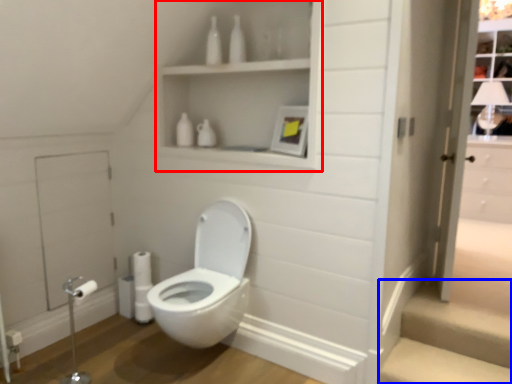
Question: Which of the following is the farthest to the observer, medicine cabinet (highlighted by a red box) or stairwell (highlighted by a blue box)?

Choices:
 (A) medicine cabinet
 (B) stairwell

Answer: (B)